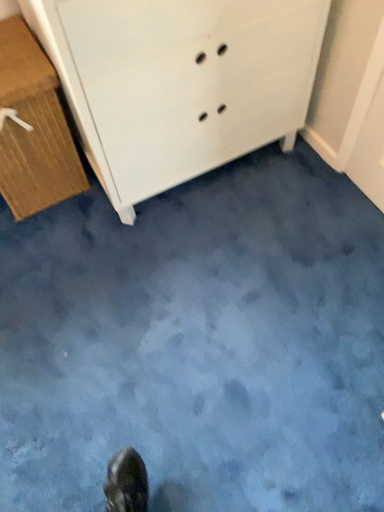
At what (x,y) coordinates should I click in order to perform the action: click on wooden chest of drawers at left, which ranks as the 1th chest of drawers in left-to-right order. Please return your answer as a coordinate pair (x, y). Image resolution: width=384 pixels, height=512 pixels. Looking at the image, I should click on (34, 128).

Describe the element at coordinates (34, 128) in the screenshot. This screenshot has height=512, width=384. I see `wooden chest of drawers at left, which is counted as the 2th chest of drawers, starting from the right` at that location.

The width and height of the screenshot is (384, 512). I want to click on white matte chest of drawers at upper center, which is the 2th chest of drawers in left-to-right order, so click(179, 82).

The height and width of the screenshot is (512, 384). Describe the element at coordinates (179, 82) in the screenshot. I see `white matte chest of drawers at upper center, the first chest of drawers when ordered from right to left` at that location.

You are a GUI agent. You are given a task and a screenshot of the screen. Output one action in this format:
    pyautogui.click(x=<x>, y=<y>)
    Task: Click on the wooden chest of drawers at left, which ranks as the 1th chest of drawers in left-to-right order
    The image size is (384, 512).
    Given the screenshot: What is the action you would take?
    pyautogui.click(x=34, y=128)

Considering the positions of objects wooden chest of drawers at left, which is counted as the 2th chest of drawers, starting from the right, and white matte chest of drawers at upper center, the first chest of drawers when ordered from right to left, in the image provided, who is more to the right, wooden chest of drawers at left, which is counted as the 2th chest of drawers, starting from the right, or white matte chest of drawers at upper center, the first chest of drawers when ordered from right to left,?

From the viewer's perspective, white matte chest of drawers at upper center, the first chest of drawers when ordered from right to left, appears more on the right side.

Is the depth of wooden chest of drawers at left, which ranks as the 1th chest of drawers in left-to-right order, greater than that of white matte chest of drawers at upper center, which is the 2th chest of drawers in left-to-right order?

Yes, wooden chest of drawers at left, which ranks as the 1th chest of drawers in left-to-right order, is further from the camera.

Considering the positions of point (43, 127) and point (127, 33), is point (43, 127) closer or farther from the camera than point (127, 33)?

Point (43, 127) appears to be farther away from the viewer than point (127, 33).

From the image's perspective, which object appears higher, wooden chest of drawers at left, which is counted as the 2th chest of drawers, starting from the right, or white matte chest of drawers at upper center, which is the 2th chest of drawers in left-to-right order?

white matte chest of drawers at upper center, which is the 2th chest of drawers in left-to-right order, appears higher in the image.

From a real-world perspective, who is located lower, wooden chest of drawers at left, which ranks as the 1th chest of drawers in left-to-right order, or white matte chest of drawers at upper center, which is the 2th chest of drawers in left-to-right order?

wooden chest of drawers at left, which ranks as the 1th chest of drawers in left-to-right order.

Considering the sizes of objects wooden chest of drawers at left, which ranks as the 1th chest of drawers in left-to-right order, and white matte chest of drawers at upper center, the first chest of drawers when ordered from right to left, in the image provided, who is wider, wooden chest of drawers at left, which ranks as the 1th chest of drawers in left-to-right order, or white matte chest of drawers at upper center, the first chest of drawers when ordered from right to left,?

white matte chest of drawers at upper center, the first chest of drawers when ordered from right to left, is wider.

Which of these two, wooden chest of drawers at left, which is counted as the 2th chest of drawers, starting from the right, or white matte chest of drawers at upper center, which is the 2th chest of drawers in left-to-right order, stands taller?

white matte chest of drawers at upper center, which is the 2th chest of drawers in left-to-right order.

Which of these two, wooden chest of drawers at left, which ranks as the 1th chest of drawers in left-to-right order, or white matte chest of drawers at upper center, which is the 2th chest of drawers in left-to-right order, is smaller?

With smaller size is wooden chest of drawers at left, which ranks as the 1th chest of drawers in left-to-right order.

Would you say wooden chest of drawers at left, which ranks as the 1th chest of drawers in left-to-right order, is inside or outside white matte chest of drawers at upper center, the first chest of drawers when ordered from right to left?

wooden chest of drawers at left, which ranks as the 1th chest of drawers in left-to-right order, is spatially situated outside white matte chest of drawers at upper center, the first chest of drawers when ordered from right to left.

Is wooden chest of drawers at left, which is counted as the 2th chest of drawers, starting from the right, beside white matte chest of drawers at upper center, the first chest of drawers when ordered from right to left?

wooden chest of drawers at left, which is counted as the 2th chest of drawers, starting from the right, and white matte chest of drawers at upper center, the first chest of drawers when ordered from right to left, are clearly separated.

Is white matte chest of drawers at upper center, which is the 2th chest of drawers in left-to-right order, at the back of wooden chest of drawers at left, which is counted as the 2th chest of drawers, starting from the right?

wooden chest of drawers at left, which is counted as the 2th chest of drawers, starting from the right, is not turned away from white matte chest of drawers at upper center, which is the 2th chest of drawers in left-to-right order.

From the picture: Can you tell me how much wooden chest of drawers at left, which is counted as the 2th chest of drawers, starting from the right, and white matte chest of drawers at upper center, the first chest of drawers when ordered from right to left, differ in facing direction?

1.49 degrees separate the facing orientations of wooden chest of drawers at left, which is counted as the 2th chest of drawers, starting from the right, and white matte chest of drawers at upper center, the first chest of drawers when ordered from right to left.

From the picture: How distant is wooden chest of drawers at left, which ranks as the 1th chest of drawers in left-to-right order, from white matte chest of drawers at upper center, the first chest of drawers when ordered from right to left?

14.93 inches.

This screenshot has height=512, width=384. Identify the location of chest of drawers above the wooden chest of drawers at left, which ranks as the 1th chest of drawers in left-to-right order (from the image's perspective). (179, 82).

Is white matte chest of drawers at upper center, which is the 2th chest of drawers in left-to-right order, at the left side of wooden chest of drawers at left, which ranks as the 1th chest of drawers in left-to-right order?

No.

From the picture: Which is in front, white matte chest of drawers at upper center, which is the 2th chest of drawers in left-to-right order, or wooden chest of drawers at left, which is counted as the 2th chest of drawers, starting from the right?

Positioned in front is white matte chest of drawers at upper center, which is the 2th chest of drawers in left-to-right order.

Between point (153, 169) and point (29, 138), which one is positioned in front?

Point (29, 138)

From the image's perspective, which is below, white matte chest of drawers at upper center, which is the 2th chest of drawers in left-to-right order, or wooden chest of drawers at left, which is counted as the 2th chest of drawers, starting from the right?

wooden chest of drawers at left, which is counted as the 2th chest of drawers, starting from the right, appears lower in the image.

From a real-world perspective, is white matte chest of drawers at upper center, the first chest of drawers when ordered from right to left, physically located above or below wooden chest of drawers at left, which is counted as the 2th chest of drawers, starting from the right?

white matte chest of drawers at upper center, the first chest of drawers when ordered from right to left, is situated higher than wooden chest of drawers at left, which is counted as the 2th chest of drawers, starting from the right, in the real world.

Considering the relative sizes of white matte chest of drawers at upper center, which is the 2th chest of drawers in left-to-right order, and wooden chest of drawers at left, which ranks as the 1th chest of drawers in left-to-right order, in the image provided, is white matte chest of drawers at upper center, which is the 2th chest of drawers in left-to-right order, thinner than wooden chest of drawers at left, which ranks as the 1th chest of drawers in left-to-right order,?

In fact, white matte chest of drawers at upper center, which is the 2th chest of drawers in left-to-right order, might be wider than wooden chest of drawers at left, which ranks as the 1th chest of drawers in left-to-right order.

Considering the sizes of white matte chest of drawers at upper center, which is the 2th chest of drawers in left-to-right order, and wooden chest of drawers at left, which ranks as the 1th chest of drawers in left-to-right order, in the image, is white matte chest of drawers at upper center, which is the 2th chest of drawers in left-to-right order, taller or shorter than wooden chest of drawers at left, which ranks as the 1th chest of drawers in left-to-right order,?

Considering their sizes, white matte chest of drawers at upper center, which is the 2th chest of drawers in left-to-right order, has more height than wooden chest of drawers at left, which ranks as the 1th chest of drawers in left-to-right order.

Considering the sizes of objects white matte chest of drawers at upper center, which is the 2th chest of drawers in left-to-right order, and wooden chest of drawers at left, which ranks as the 1th chest of drawers in left-to-right order, in the image provided, who is bigger, white matte chest of drawers at upper center, which is the 2th chest of drawers in left-to-right order, or wooden chest of drawers at left, which ranks as the 1th chest of drawers in left-to-right order,?

white matte chest of drawers at upper center, which is the 2th chest of drawers in left-to-right order, is bigger.

Would you say wooden chest of drawers at left, which ranks as the 1th chest of drawers in left-to-right order, is part of white matte chest of drawers at upper center, the first chest of drawers when ordered from right to left,'s contents?

No, wooden chest of drawers at left, which ranks as the 1th chest of drawers in left-to-right order, is not surrounded by white matte chest of drawers at upper center, the first chest of drawers when ordered from right to left.

Is white matte chest of drawers at upper center, the first chest of drawers when ordered from right to left, directly adjacent to wooden chest of drawers at left, which ranks as the 1th chest of drawers in left-to-right order?

white matte chest of drawers at upper center, the first chest of drawers when ordered from right to left, is not next to wooden chest of drawers at left, which ranks as the 1th chest of drawers in left-to-right order, and they're not touching.

Could you tell me if white matte chest of drawers at upper center, which is the 2th chest of drawers in left-to-right order, is facing wooden chest of drawers at left, which is counted as the 2th chest of drawers, starting from the right?

No, white matte chest of drawers at upper center, which is the 2th chest of drawers in left-to-right order, is not aimed at wooden chest of drawers at left, which is counted as the 2th chest of drawers, starting from the right.

Measure the distance between white matte chest of drawers at upper center, the first chest of drawers when ordered from right to left, and wooden chest of drawers at left, which is counted as the 2th chest of drawers, starting from the right.

They are 37.92 centimeters apart.

Where is `the chest of drawers that appears below the white matte chest of drawers at upper center, which is the 2th chest of drawers in left-to-right order (from the image's perspective)`? the chest of drawers that appears below the white matte chest of drawers at upper center, which is the 2th chest of drawers in left-to-right order (from the image's perspective) is located at coordinates click(x=34, y=128).

Where is `chest of drawers on the right side of wooden chest of drawers at left, which is counted as the 2th chest of drawers, starting from the right`? This screenshot has height=512, width=384. chest of drawers on the right side of wooden chest of drawers at left, which is counted as the 2th chest of drawers, starting from the right is located at coordinates (179, 82).

Where is `chest of drawers on the left of white matte chest of drawers at upper center, which is the 2th chest of drawers in left-to-right order`? Image resolution: width=384 pixels, height=512 pixels. chest of drawers on the left of white matte chest of drawers at upper center, which is the 2th chest of drawers in left-to-right order is located at coordinates (34, 128).